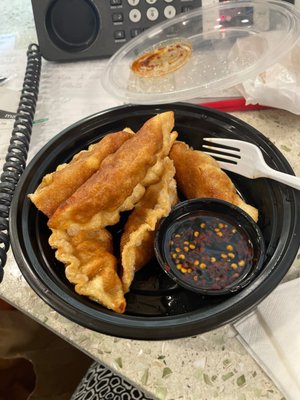
Where is `straw for drinking fluid`? straw for drinking fluid is located at coordinates (237, 102).